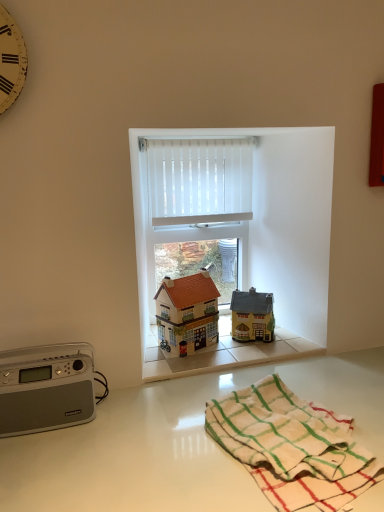
In order to click on vacant area that lies to the right of silver metallic radio at left in this screenshot , I will do `click(127, 424)`.